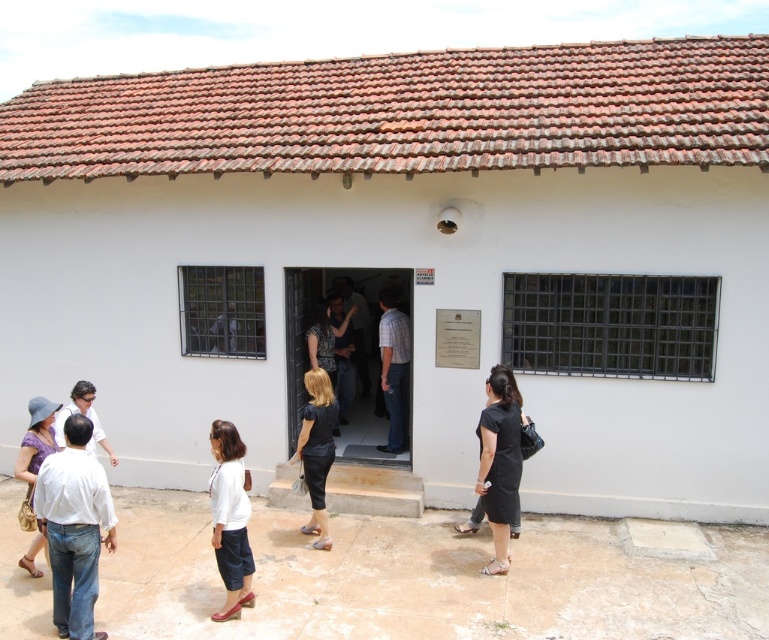
You are a photographer trying to capture a group photo of the people at the entrance. You need to arrange them so that the plaid shirt at center and dark gray fabric shirt at center are side by side. Based on their current positions, which shirt should be placed to the left to maintain their original spatial relationship?

The dark gray fabric shirt at center should be placed to the left because the plaid shirt at center is currently on the right side of the dark gray fabric shirt at center.

You are standing outside the building and want to take a photo of both point (62, 548) and point (313, 410). Since you want both points in focus, which point should you focus on to ensure both are sharp?

You should focus on point (313, 410) because it is farther from the camera than point (62, 548). By focusing on the farther point, the near point will also be in focus due to the depth of field.